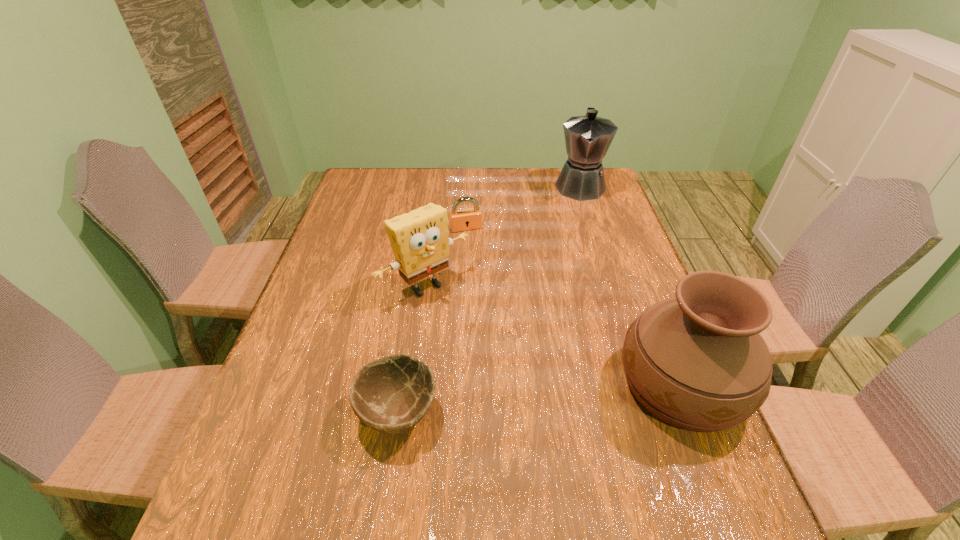
The height and width of the screenshot is (540, 960). I want to click on free space on the desktop that is between the bowl and the urn and is positioned at the spout of the farthest object, so click(x=569, y=395).

Identify the location of free space on the desktop that is between the shortest object and the urn and is positioned to unlock the fourth tallest object from the front. (535, 399).

Identify the location of free space on the desktop that is between the shortest object and the urn and is positioned on the face of the sponge. (534, 399).